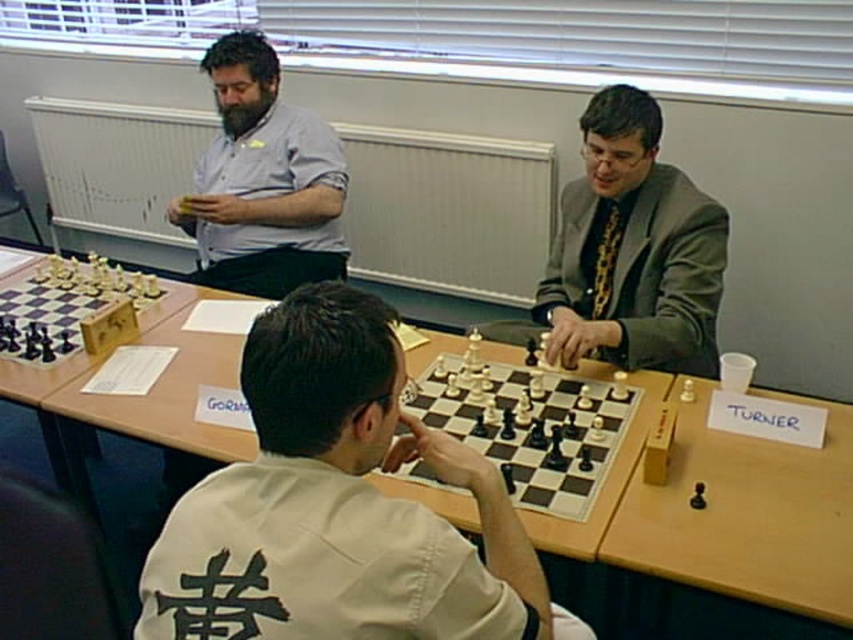
Question: Estimate the real-world distances between objects in this image. Which object is closer to the wooden chessboard at center?

Choices:
 (A) metallic chess set at left
 (B) white matte chessboard at center

Answer: (B)

Question: Among these objects, which one is farthest from the camera?

Choices:
 (A) white matte chessboard at center
 (B) matte gray suit at center
 (C) white wooden chessboard at center

Answer: (B)

Question: Can you confirm if white matte chessboard at center is bigger than matte gray suit at center?

Choices:
 (A) no
 (B) yes

Answer: (A)

Question: Is white matte chessboard at center to the left of white wooden chessboard at center from the viewer's perspective?

Choices:
 (A) no
 (B) yes

Answer: (B)

Question: Which of these objects is positioned farthest from the matte gray shirt at upper left?

Choices:
 (A) matte gray suit at center
 (B) white wooden chessboard at center

Answer: (B)

Question: Where is matte gray suit at center located in relation to wooden chessboard at center in the image?

Choices:
 (A) right
 (B) left

Answer: (B)